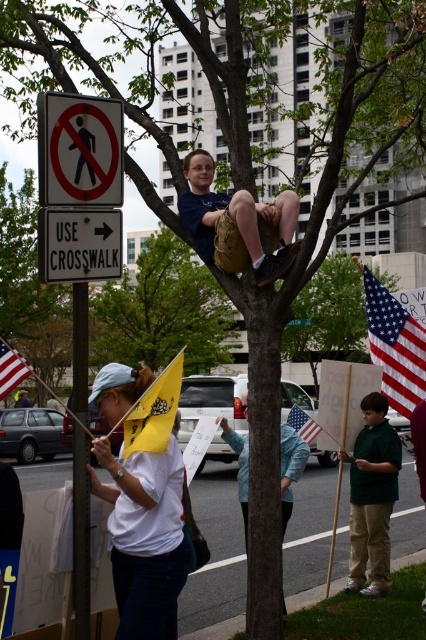
Which is more to the right, matte blue shirt at upper center or yellow paper flag at center?

matte blue shirt at upper center

Locate an element on the screen. This screenshot has height=640, width=426. matte blue shirt at upper center is located at coordinates (238, 225).

You are a GUI agent. You are given a task and a screenshot of the screen. Output one action in this format:
    pyautogui.click(x=<x>, y=<y>)
    Task: Click on the matte blue shirt at upper center
    
    Given the screenshot: What is the action you would take?
    pyautogui.click(x=238, y=225)

Does american flag at upper right have a lesser height compared to yellow paper flag at center?

Incorrect, american flag at upper right's height does not fall short of yellow paper flag at center's.

Is point (423, 344) positioned before point (167, 401)?

No, (423, 344) is further to viewer.

Who is more distant from viewer, (373, 289) or (149, 408)?

Positioned behind is point (373, 289).

Locate an element on the screen. The height and width of the screenshot is (640, 426). american flag at upper right is located at coordinates pos(394,346).

The image size is (426, 640). Describe the element at coordinates (78, 244) in the screenshot. I see `white plastic sign at upper left` at that location.

The width and height of the screenshot is (426, 640). In order to click on white plastic sign at upper left in this screenshot , I will do `click(78, 244)`.

Where is `white plastic sign at upper left`? The height and width of the screenshot is (640, 426). white plastic sign at upper left is located at coordinates (78, 244).